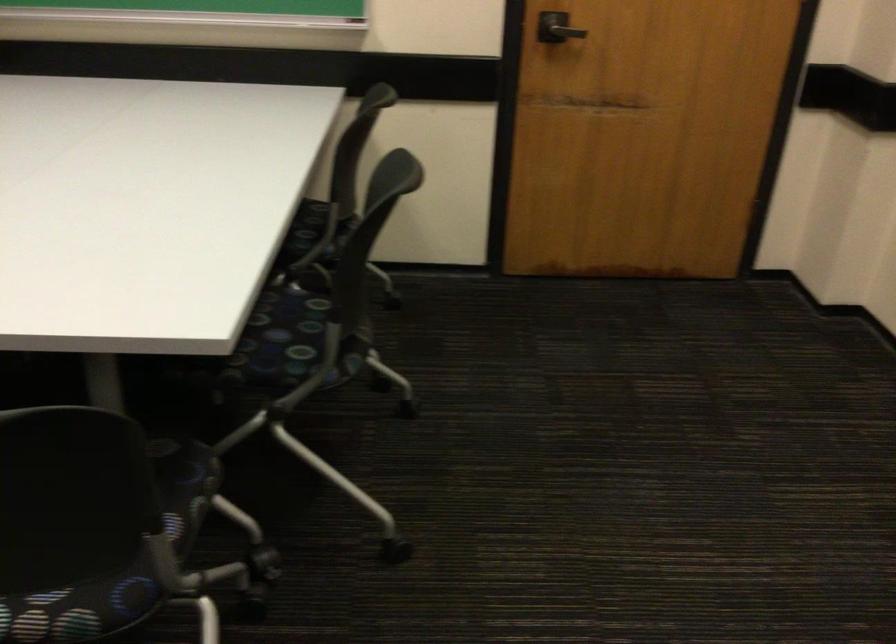
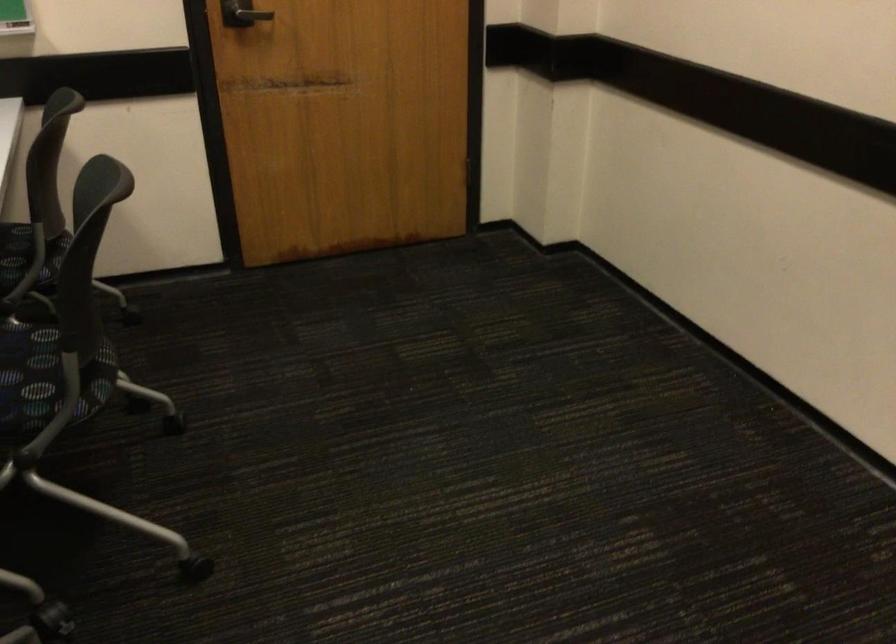
Question: How did the camera likely rotate?

Choices:
 (A) Left
 (B) Right
 (C) Up
 (D) Down

Answer: (B)